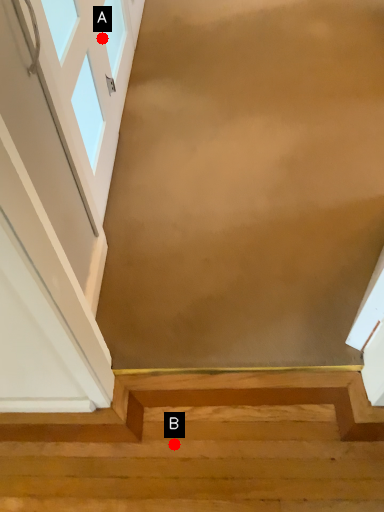
Question: Two points are circled on the image, labeled by A and B beside each circle. Which point is further to the camera?

Choices:
 (A) A is further
 (B) B is further

Answer: (A)